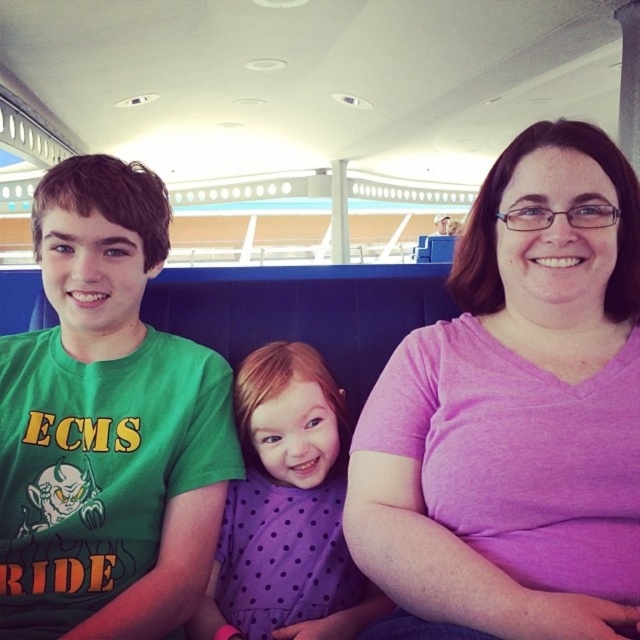
Is purple cotton shirt at center smaller than green matte t-shirt at left?

No.

Is purple cotton shirt at center closer to camera compared to green matte t-shirt at left?

Yes, purple cotton shirt at center is closer to the viewer.

Between point (404, 548) and point (0, 618), which one is positioned in front?

Point (404, 548) is more forward.

Where is `purple cotton shirt at center`? This screenshot has height=640, width=640. purple cotton shirt at center is located at coordinates (516, 413).

Who is positioned more to the left, purple cotton shirt at center or purple dotted dress at center?

purple dotted dress at center is more to the left.

Looking at this image, who is lower down, purple cotton shirt at center or purple dotted dress at center?

purple dotted dress at center

Is point (596, 540) positioned in front of point (237, 506)?

Yes.

Locate an element on the screen. The width and height of the screenshot is (640, 640). purple cotton shirt at center is located at coordinates (516, 413).

Does green matte t-shirt at left have a greater width compared to purple dotted dress at center?

Yes.

Does green matte t-shirt at left have a smaller size compared to purple dotted dress at center?

No.

Which is behind, point (65, 298) or point (340, 468)?

The point (340, 468) is behind.

Where is `green matte t-shirt at left`? green matte t-shirt at left is located at coordinates (106, 426).